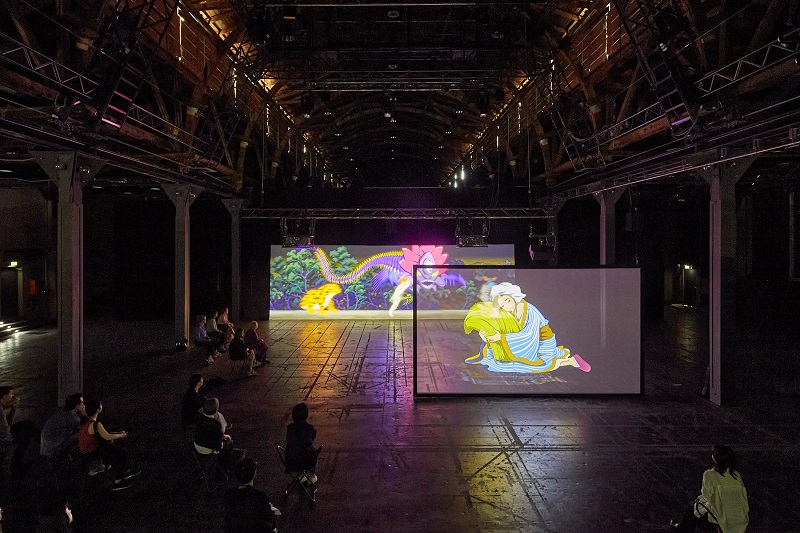
This screenshot has width=800, height=533. I want to click on column, so click(x=69, y=346), click(x=178, y=288), click(x=236, y=274), click(x=718, y=343), click(x=604, y=242).